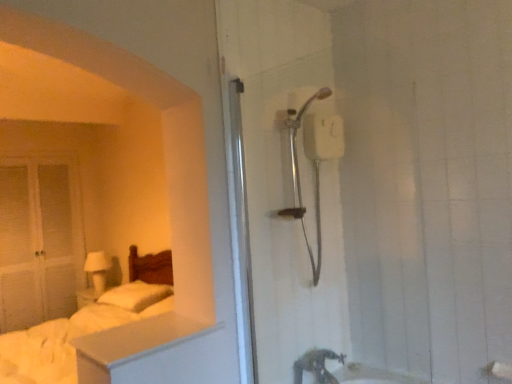
Identify the location of vacant area on top of white matte glass door at left (from a real-world perspective). The height and width of the screenshot is (384, 512). (34, 144).